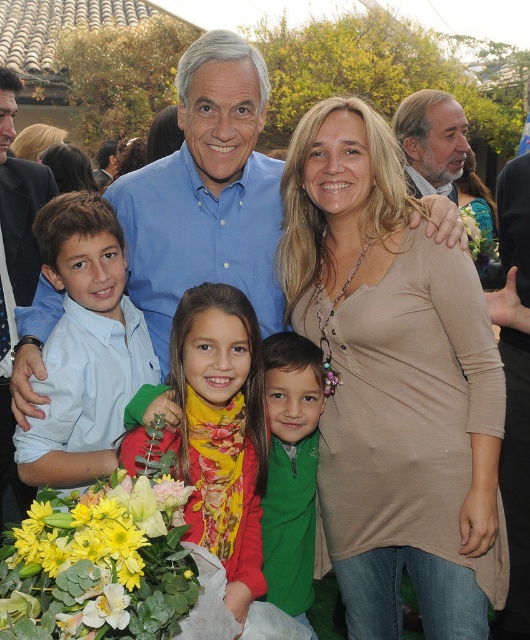
Looking at this image, you are a photographer adjusting the camera settings. You notice the yellow matte flowers at lower left and the gray hair man at upper right. Which object is shorter in height?

The yellow matte flowers at lower left has a lesser height compared to gray hair man at upper right, so the yellow matte flowers at lower left is shorter.

You are organizing a picnic and need to place the yellow matte flowers at lower left and the green fleece jacket at center into a small basket. Which item should you place first to ensure both fit?

The yellow matte flowers at lower left should be placed first in the basket since they occupy less space than the green fleece jacket at center, allowing both items to fit properly.

You are standing in the courtyard and want to place a small decoration between the two points, point (43, 621) and point (306, 500). Which point should the decoration be closer to in order to be nearer to you?

The decoration should be closer to point (43, 621) because it is nearer to the viewer than point (306, 500).